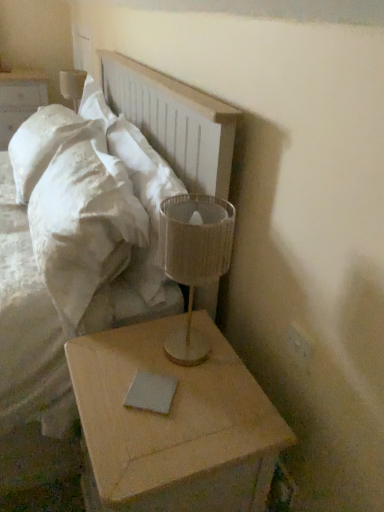
I want to click on free space behind gray matte notepad at lower center, so click(x=167, y=346).